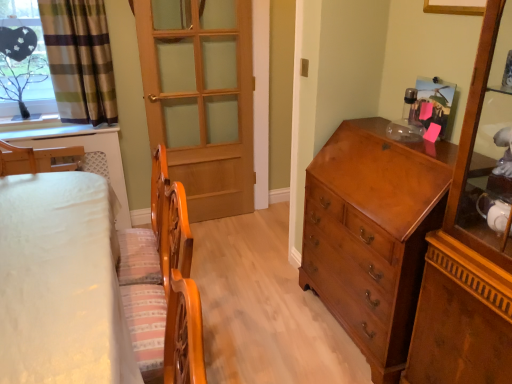
The width and height of the screenshot is (512, 384). I want to click on shiny brown cabinet at right, so click(x=473, y=235).

Where is `shiny brown wooden chest of drawers at right`? Image resolution: width=512 pixels, height=384 pixels. shiny brown wooden chest of drawers at right is located at coordinates (373, 234).

This screenshot has width=512, height=384. In order to click on clear glass tree at upper left in this screenshot , I will do `click(23, 60)`.

Measure the distance between point (242,202) and camera.

Point (242,202) and camera are 3.39 meters apart from each other.

Find the location of a particular element. This screenshot has height=384, width=512. shiny brown cabinet at right is located at coordinates (473, 235).

From the picture: Can you confirm if shiny brown cabinet at right is wider than shiny brown wooden chest of drawers at right?

Incorrect, the width of shiny brown cabinet at right does not surpass that of shiny brown wooden chest of drawers at right.

Considering the sizes of objects shiny brown cabinet at right and shiny brown wooden chest of drawers at right in the image provided, who is taller, shiny brown cabinet at right or shiny brown wooden chest of drawers at right?

shiny brown cabinet at right.

From a real-world perspective, which is physically above, shiny brown cabinet at right or shiny brown wooden chest of drawers at right?

From a 3D spatial view, shiny brown cabinet at right is above.

Which object is positioned more to the left, shiny brown cabinet at right or shiny brown wooden chest of drawers at right?

Positioned to the left is shiny brown wooden chest of drawers at right.

How far apart are white fabric bed at left and shiny brown cabinet at right?

They are 1.26 meters apart.

Based on their positions, is white fabric bed at left located to the left or right of shiny brown cabinet at right?

white fabric bed at left is positioned on shiny brown cabinet at right's left side.

Is white fabric bed at left positioned with its back to shiny brown cabinet at right?

That's not correct — white fabric bed at left is not looking away from shiny brown cabinet at right.

Considering their positions, is clear glass tree at upper left located in front of or behind white fabric bed at left?

clear glass tree at upper left is positioned farther from the viewer than white fabric bed at left.

Considering the sizes of objects clear glass tree at upper left and white fabric bed at left in the image provided, who is shorter, clear glass tree at upper left or white fabric bed at left?

Standing shorter between the two is clear glass tree at upper left.

Considering the relative positions of clear glass tree at upper left and white fabric bed at left in the image provided, is clear glass tree at upper left to the right of white fabric bed at left from the viewer's perspective?

In fact, clear glass tree at upper left is to the left of white fabric bed at left.

Considering the sizes of clear glass tree at upper left and white fabric bed at left in the image, is clear glass tree at upper left wider or thinner than white fabric bed at left?

Clearly, clear glass tree at upper left has less width compared to white fabric bed at left.

Is green plaid fabric at upper left positioned with its back to clear glass tree at upper left?

green plaid fabric at upper left does not have its back to clear glass tree at upper left.

From the image's perspective, is green plaid fabric at upper left on clear glass tree at upper left?

Indeed, from the image's perspective, green plaid fabric at upper left is shown above clear glass tree at upper left.

Between green plaid fabric at upper left and clear glass tree at upper left, which one has larger size?

green plaid fabric at upper left.

Is wooden door at center aimed at green plaid fabric at upper left?

No.

Considering the positions of objects wooden door at center and green plaid fabric at upper left in the image provided, who is more to the right, wooden door at center or green plaid fabric at upper left?

wooden door at center is more to the right.

How distant is wooden door at center from green plaid fabric at upper left?

A distance of 21.36 inches exists between wooden door at center and green plaid fabric at upper left.

From the image's perspective, which one is positioned higher, clear glass tree at upper left or green plaid fabric at upper left?

green plaid fabric at upper left, from the image's perspective.

From a real-world perspective, which is physically below, clear glass tree at upper left or green plaid fabric at upper left?

clear glass tree at upper left.

Are clear glass tree at upper left and green plaid fabric at upper left far apart?

No, clear glass tree at upper left is not far away from green plaid fabric at upper left.

Consider the image. From their relative heights in the image, would you say shiny brown cabinet at right is taller or shorter than white fabric bed at left?

Considering their sizes, shiny brown cabinet at right has more height than white fabric bed at left.

Between shiny brown cabinet at right and white fabric bed at left, which one appears on the right side from the viewer's perspective?

shiny brown cabinet at right.

Consider the image. Between shiny brown cabinet at right and white fabric bed at left, which one has smaller width?

With smaller width is shiny brown cabinet at right.

Does shiny brown cabinet at right have a larger size compared to white fabric bed at left?

No.

You are a GUI agent. You are given a task and a screenshot of the screen. Output one action in this format:
    pyautogui.click(x=<x>, y=<y>)
    Task: Click on the cabinetry positioned vertically above the shiny brown wooden chest of drawers at right (from a real-world perspective)
    The width and height of the screenshot is (512, 384).
    Given the screenshot: What is the action you would take?
    pyautogui.click(x=473, y=235)

Locate an element on the screen. The height and width of the screenshot is (384, 512). cabinetry behind the white fabric bed at left is located at coordinates (473, 235).

Considering their positions, is wooden door at center positioned further to clear glass tree at upper left than green plaid fabric at upper left?

wooden door at center lies further to clear glass tree at upper left than the other object.

From the image, which object appears to be nearer to clear glass tree at upper left, shiny brown cabinet at right or shiny brown wooden chest of drawers at right?

Based on the image, shiny brown wooden chest of drawers at right appears to be nearer to clear glass tree at upper left.

Based on their spatial positions, is shiny brown wooden chest of drawers at right or wooden door at center closer to clear glass tree at upper left?

wooden door at center is positioned closer to the anchor clear glass tree at upper left.

From the image, which object appears to be nearer to wooden door at center, white fabric bed at left or green plaid fabric at upper left?

green plaid fabric at upper left.

Based on their spatial positions, is wooden door at center or white fabric bed at left further from clear glass tree at upper left?

white fabric bed at left lies further to clear glass tree at upper left than the other object.

Estimate the real-world distances between objects in this image. Which object is closer to green plaid fabric at upper left, wooden door at center or clear glass tree at upper left?

The object closer to green plaid fabric at upper left is clear glass tree at upper left.

From the image, which object appears to be farther from white fabric bed at left, shiny brown wooden chest of drawers at right or clear glass tree at upper left?

clear glass tree at upper left is positioned further to the anchor white fabric bed at left.

Based on their spatial positions, is wooden door at center or clear glass tree at upper left closer to shiny brown wooden chest of drawers at right?

wooden door at center lies closer to shiny brown wooden chest of drawers at right than the other object.

Locate an element on the screen. The height and width of the screenshot is (384, 512). door between clear glass tree at upper left and shiny brown wooden chest of drawers at right from left to right is located at coordinates (201, 98).

Locate an element on the screen. The height and width of the screenshot is (384, 512). the chest of drawers located between green plaid fabric at upper left and shiny brown cabinet at right in the left-right direction is located at coordinates (373, 234).

The height and width of the screenshot is (384, 512). Find the location of `curtain located between clear glass tree at upper left and shiny brown cabinet at right in the left-right direction`. curtain located between clear glass tree at upper left and shiny brown cabinet at right in the left-right direction is located at coordinates (80, 60).

Find the location of `curtain between clear glass tree at upper left and wooden door at center`. curtain between clear glass tree at upper left and wooden door at center is located at coordinates (80, 60).